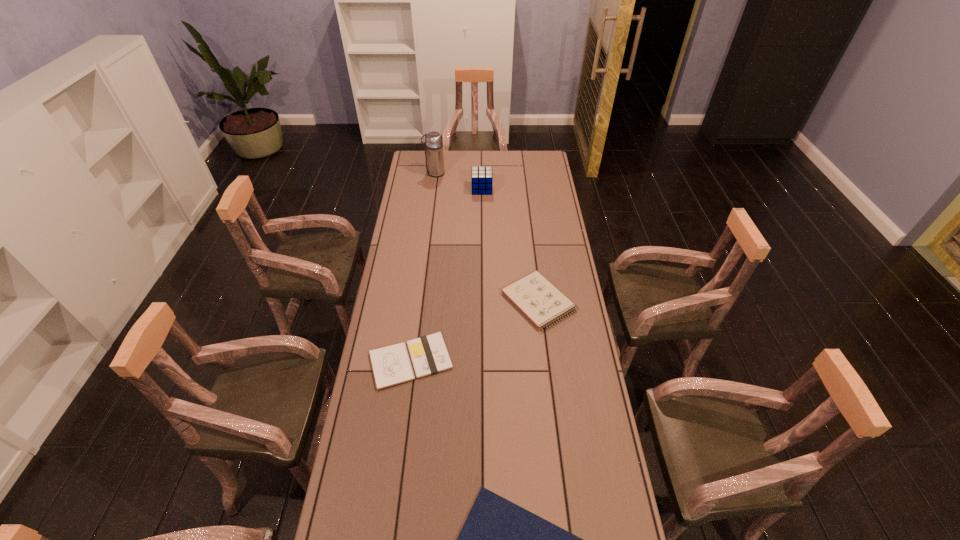
Identify the location of object identified as the closest to the third shortest object. (391, 365).

Identify the location of the closest notepad to the third shortest object. The height and width of the screenshot is (540, 960). (391, 365).

The height and width of the screenshot is (540, 960). In order to click on notepad that is the second nearest to the tallest notepad in this screenshot , I will do `click(499, 539)`.

This screenshot has width=960, height=540. I want to click on vacant point that satisfies the following two spatial constraints: 1. with a handle on the side of the farthest object; 2. on the left side of the second tallest object, so click(x=433, y=189).

Find the location of `free space that satisfies the following two spatial constraints: 1. on the back side of the cube; 2. with a handle on the side of the tallest object`. free space that satisfies the following two spatial constraints: 1. on the back side of the cube; 2. with a handle on the side of the tallest object is located at coordinates (482, 173).

Locate an element on the screen. This screenshot has width=960, height=540. vacant space that satisfies the following two spatial constraints: 1. on the back side of the tallest notepad; 2. with a handle on the side of the tallest object is located at coordinates (523, 173).

Locate an element on the screen. vacant area in the image that satisfies the following two spatial constraints: 1. with a handle on the side of the third tallest object; 2. on the left side of the thermos bottle is located at coordinates (419, 301).

You are a GUI agent. You are given a task and a screenshot of the screen. Output one action in this format:
    pyautogui.click(x=<x>, y=<y>)
    Task: Click on the free space that satisfies the following two spatial constraints: 1. with a handle on the side of the cube; 2. on the right side of the tallest object
    This screenshot has width=960, height=540.
    Given the screenshot: What is the action you would take?
    pyautogui.click(x=433, y=189)

Locate an element on the screen. This screenshot has height=540, width=960. vacant area in the image that satisfies the following two spatial constraints: 1. with a handle on the side of the tallest object; 2. on the back side of the third tallest object is located at coordinates (419, 301).